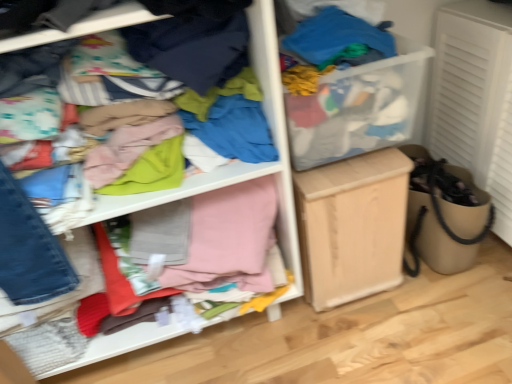
Question: Is light wood cabinet at center outside cloth at left?

Choices:
 (A) yes
 (B) no

Answer: (A)

Question: Considering the relative sizes of light wood cabinet at center and cloth at left in the image provided, is light wood cabinet at center taller than cloth at left?

Choices:
 (A) no
 (B) yes

Answer: (A)

Question: Is light wood cabinet at center at the right side of cloth at left?

Choices:
 (A) no
 (B) yes

Answer: (B)

Question: Considering the relative sizes of light wood cabinet at center and cloth at left in the image provided, is light wood cabinet at center wider than cloth at left?

Choices:
 (A) yes
 (B) no

Answer: (B)

Question: Does light wood cabinet at center lie in front of cloth at left?

Choices:
 (A) yes
 (B) no

Answer: (B)

Question: From a real-world perspective, is light wood cabinet at center over cloth at left?

Choices:
 (A) yes
 (B) no

Answer: (B)

Question: Considering the relative sizes of cloth at left and light wood cabinet at center in the image provided, is cloth at left smaller than light wood cabinet at center?

Choices:
 (A) no
 (B) yes

Answer: (A)

Question: Considering the relative positions of cloth at left and light wood cabinet at center in the image provided, is cloth at left in front of light wood cabinet at center?

Choices:
 (A) no
 (B) yes

Answer: (B)

Question: Would you say cloth at left is outside light wood cabinet at center?

Choices:
 (A) no
 (B) yes

Answer: (B)

Question: Can you see cloth at left touching light wood cabinet at center?

Choices:
 (A) no
 (B) yes

Answer: (A)

Question: Does cloth at left appear on the right side of light wood cabinet at center?

Choices:
 (A) yes
 (B) no

Answer: (B)

Question: Could light wood cabinet at center be considered to be inside cloth at left?

Choices:
 (A) yes
 (B) no

Answer: (B)

Question: Considering their positions, is light wood cabinet at center located in front of or behind cloth at left?

Choices:
 (A) behind
 (B) front

Answer: (A)